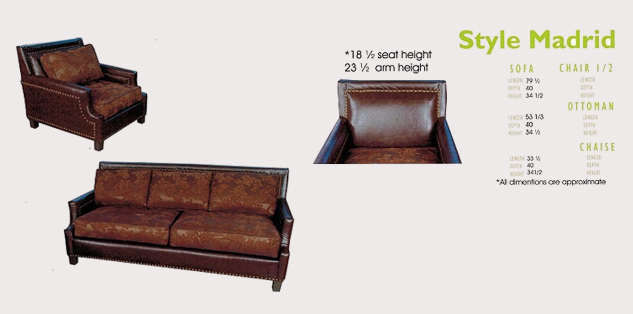
Identify the location of right chair arm. (76, 205).